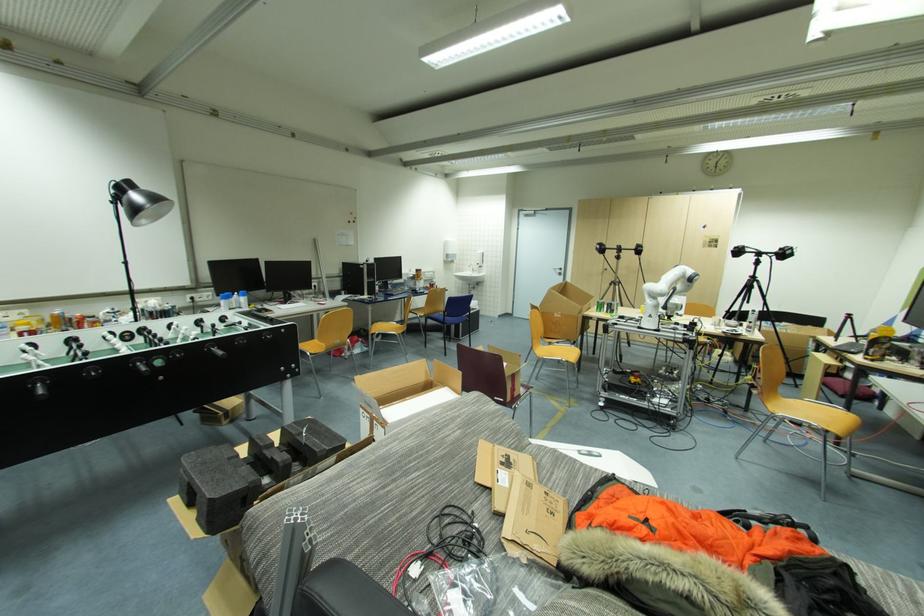
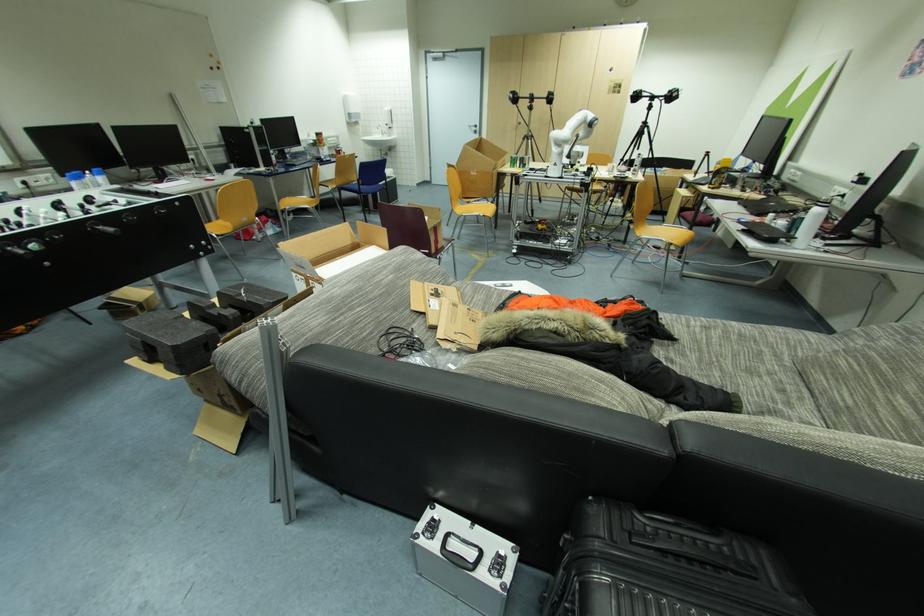
Question: The images are taken continuously from a first-person perspective. In which direction is your viewpoint rotating?

Choices:
 (A) Left
 (B) Right
 (C) Up
 (D) Down

Answer: (D)